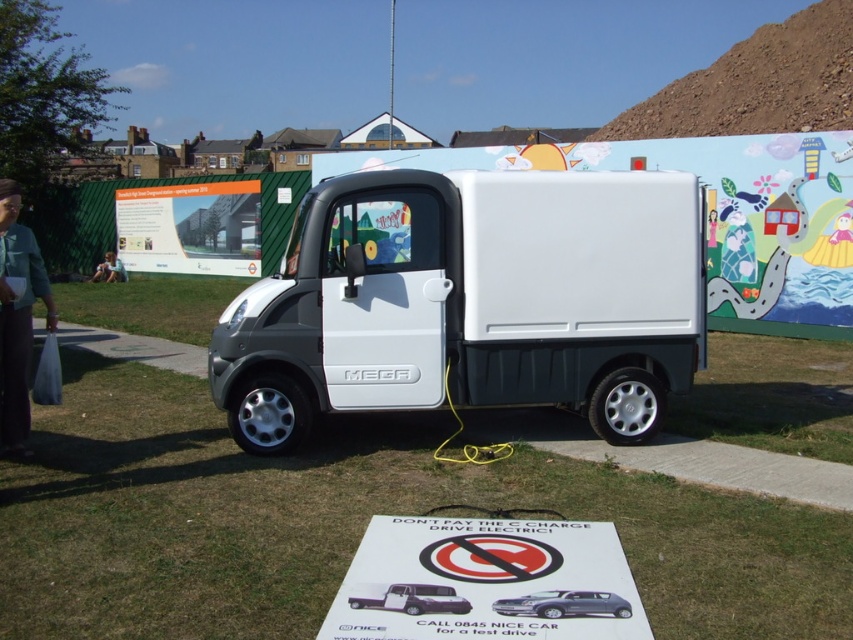
Question: Among these points, which one is farthest from the camera?

Choices:
 (A) (222, 396)
 (B) (444, 531)
 (C) (102, 269)

Answer: (C)

Question: Is white paper sign at center below denim jacket at left?

Choices:
 (A) no
 (B) yes

Answer: (B)

Question: Can you confirm if denim jacket at left is thinner than satin silver car at center?

Choices:
 (A) yes
 (B) no

Answer: (A)

Question: Which point is farther from the camera taking this photo?

Choices:
 (A) (537, 609)
 (B) (91, 276)
 (C) (543, 602)
 (D) (16, 444)

Answer: (B)

Question: Which is nearer to the green grass at lower center?

Choices:
 (A) metallic silver car at center
 (B) white matte truck at center

Answer: (B)

Question: Is white matte truck at center positioned in front of satin silver car at center?

Choices:
 (A) no
 (B) yes

Answer: (A)